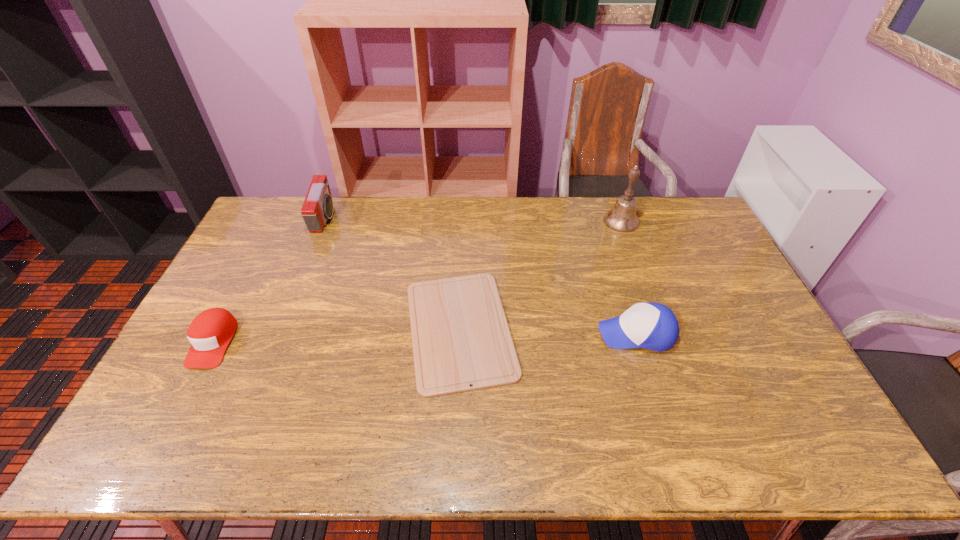
What are the coordinates of `vacant region between the taller baseball cap and the bell` in the screenshot? It's located at (629, 277).

Find the location of `vacant area between the third tallest object and the tallest object`. vacant area between the third tallest object and the tallest object is located at coordinates (629, 277).

Select which object appears as the fourth closest to the right baseball cap. Please provide its 2D coordinates. Your answer should be formatted as a tuple, i.e. [(x, y)], where the tuple contains the x and y coordinates of a point satisfying the conditions above.

[(211, 331)]

Identify which object is located as the third nearest to the third tallest object. Please provide its 2D coordinates. Your answer should be formatted as a tuple, i.e. [(x, y)], where the tuple contains the x and y coordinates of a point satisfying the conditions above.

[(317, 208)]

The width and height of the screenshot is (960, 540). I want to click on vacant area that satisfies the following two spatial constraints: 1. on the front-facing side of the fourth object from right to left; 2. on the left side of the bell, so click(x=324, y=221).

Locate an element on the screen. Image resolution: width=960 pixels, height=540 pixels. free space that satisfies the following two spatial constraints: 1. on the front-facing side of the second object from left to right; 2. on the front-facing side of the shorter baseball cap is located at coordinates click(x=275, y=342).

You are a GUI agent. You are given a task and a screenshot of the screen. Output one action in this format:
    pyautogui.click(x=<x>, y=<y>)
    Task: Click on the free space in the image that satisfies the following two spatial constraints: 1. on the front-facing side of the bell; 2. on the left side of the fourth object from right to left
    The height and width of the screenshot is (540, 960).
    Given the screenshot: What is the action you would take?
    pyautogui.click(x=324, y=221)